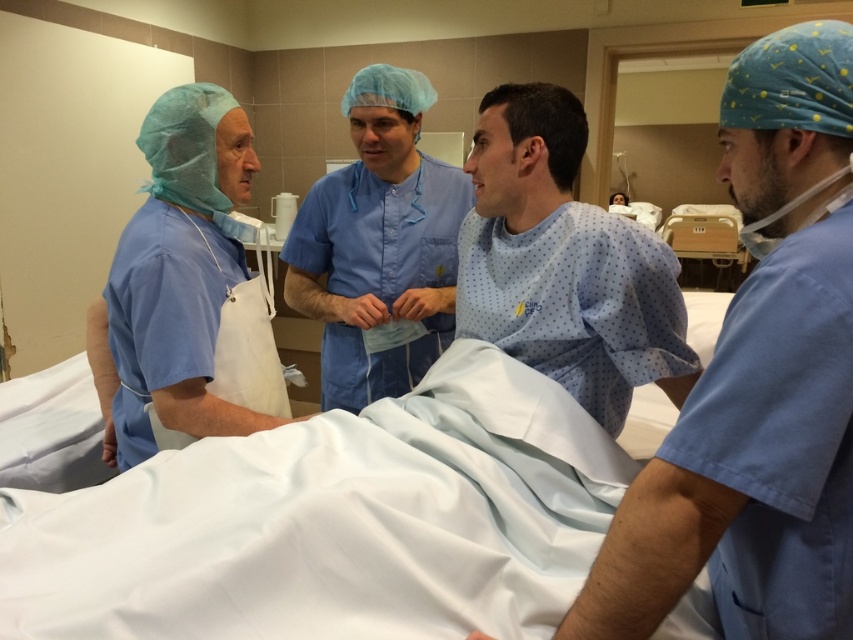
You are a medical student standing at the entrance of the hospital room. You need to measure the distance between yourself and the light blue fabric at center. Can you estimate if it is more than 4 feet?

The light blue fabric at center is 4.22 feet away from the camera, so yes, the distance is more than 4 feet.

You are a medical supply manager checking the inventory of scrubs. You need to determine if the blue scrubs at left can fit into the same storage container as the blue smooth scrubs at center. The container can only accommodate items up to the size of the narrower scrub. Which scrub should you prioritize placing first?

The blue smooth scrubs at center are narrower than the blue scrubs at left. Since the container can only hold items up to the narrower scrub size, you should prioritize placing the blue smooth scrubs at center first to ensure they fit properly.